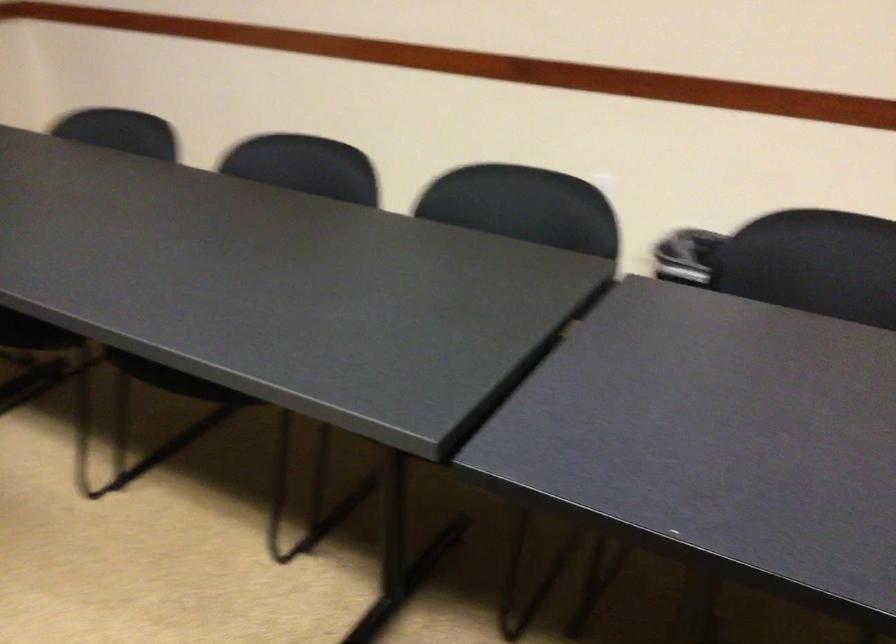
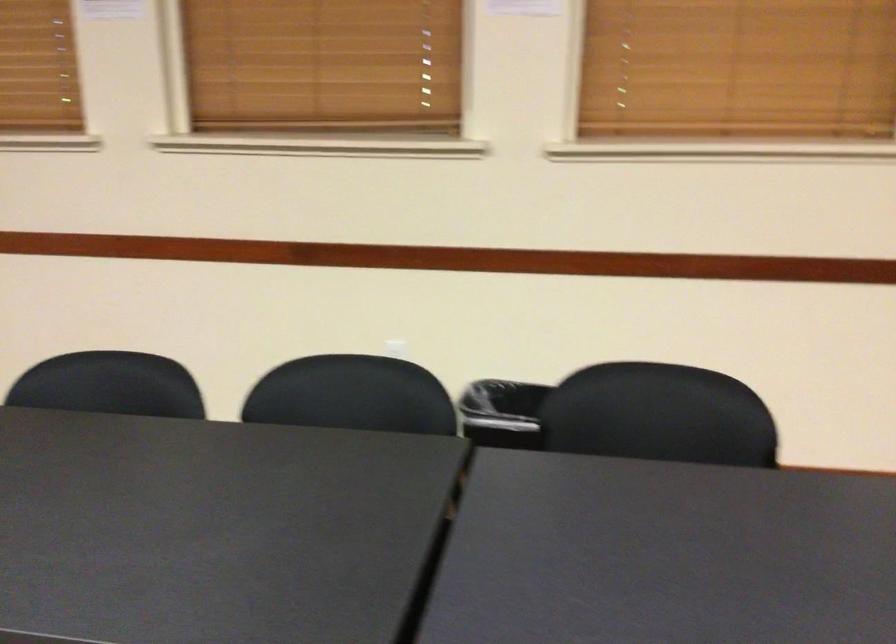
Question: The images are taken continuously from a first-person perspective. In which direction are you moving?

Choices:
 (A) Left
 (B) Right
 (C) Forward
 (D) Backward

Answer: (A)